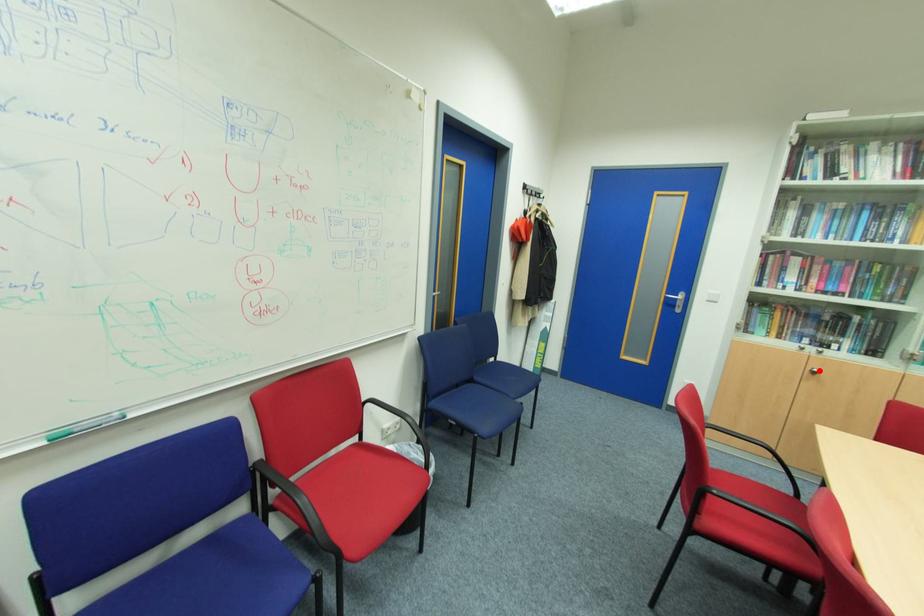
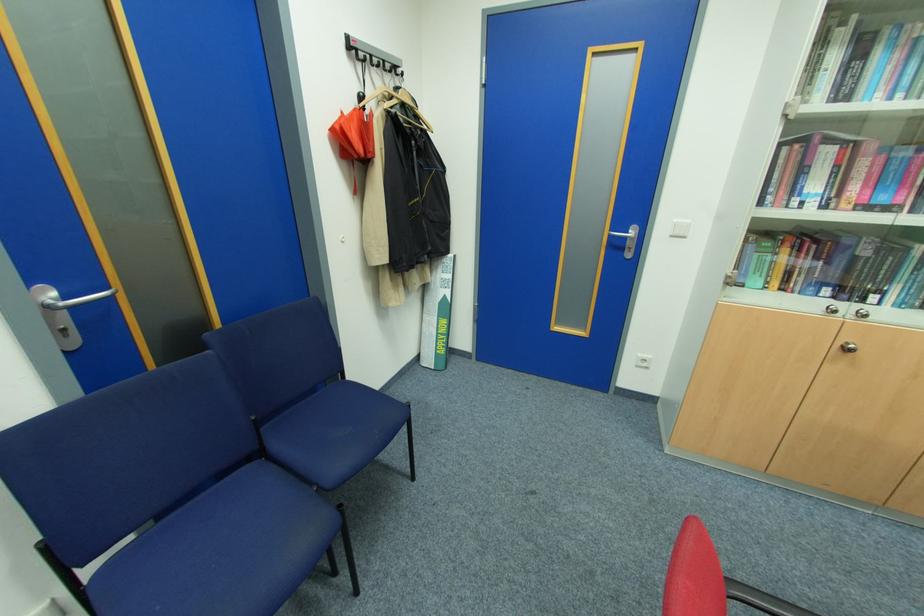
Where in the second image is the point corresponding to the highlighted location from the first image?

(856, 346)